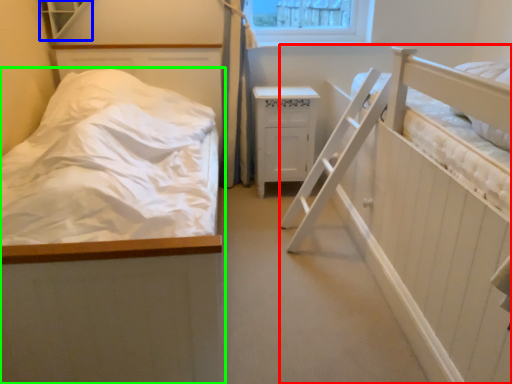
Question: Considering the real-world distances, which object is closest to hospital bed (highlighted by a red box)? window (highlighted by a blue box) or bed (highlighted by a green box).

Choices:
 (A) window
 (B) bed

Answer: (B)